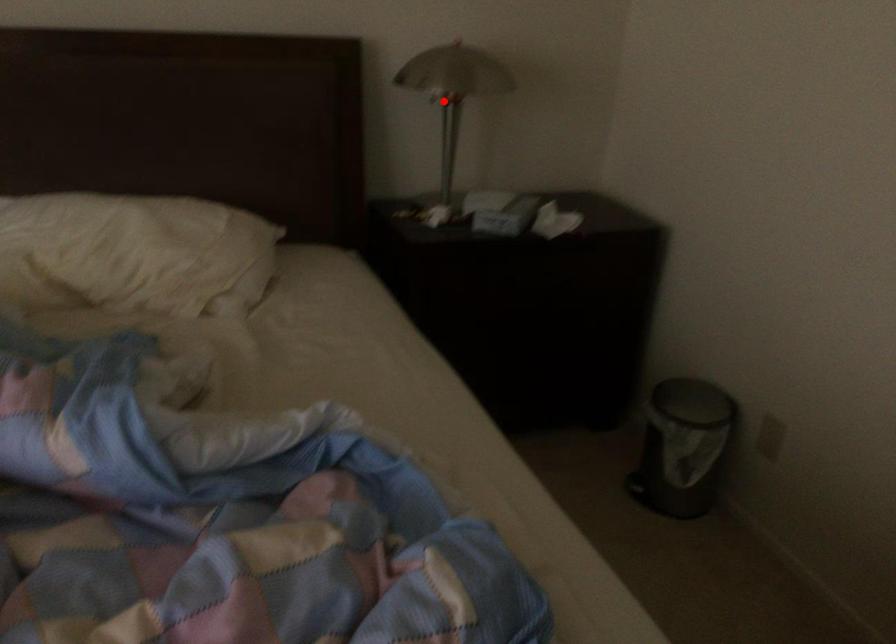
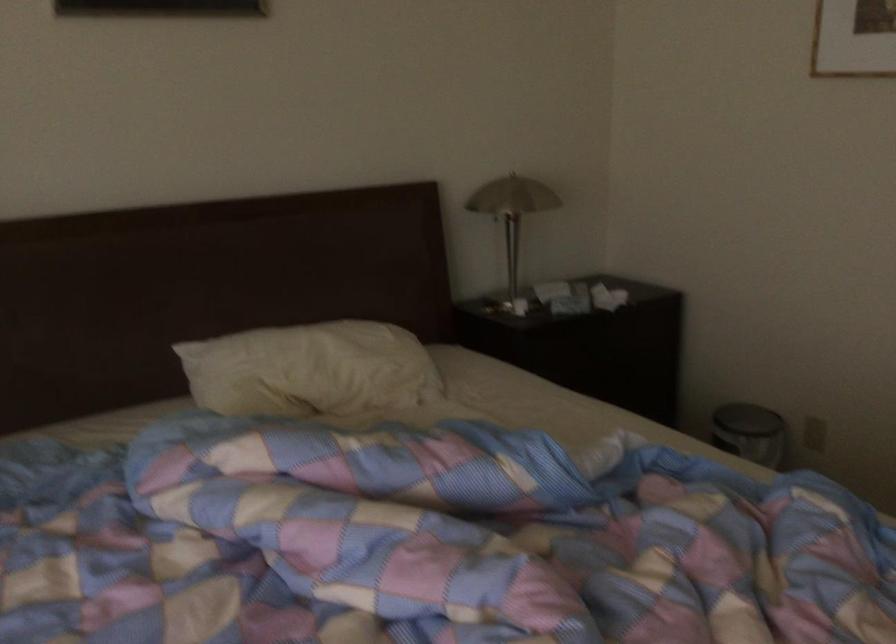
Find the pixel in the second image that matches the highlighted location in the first image.

(512, 213)